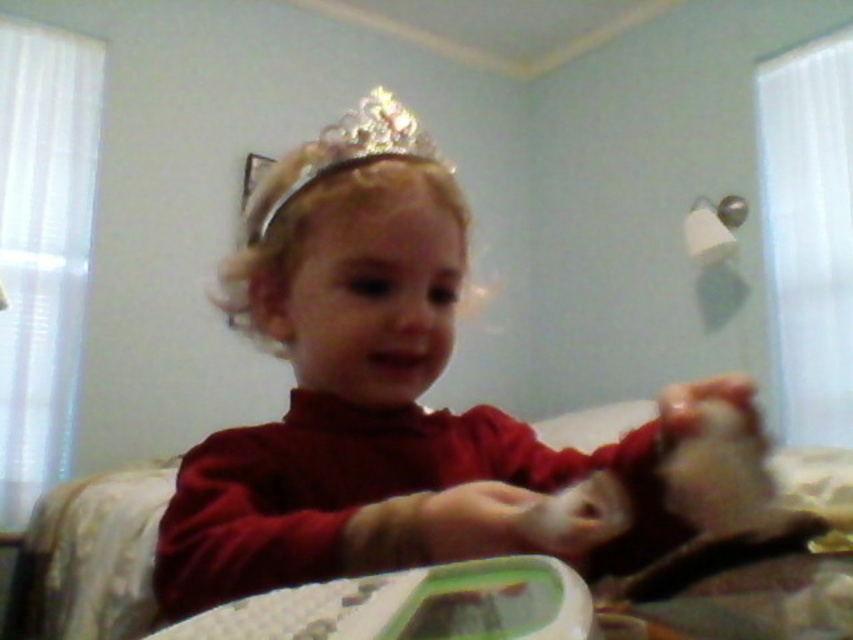
Question: Does matte red shirt at center have a lesser width compared to sparkly gold crown at upper center?

Choices:
 (A) yes
 (B) no

Answer: (A)

Question: Does matte red shirt at center appear under sparkly gold crown at upper center?

Choices:
 (A) no
 (B) yes

Answer: (B)

Question: Considering the relative positions of matte red shirt at center and sparkly gold crown at upper center in the image provided, where is matte red shirt at center located with respect to sparkly gold crown at upper center?

Choices:
 (A) left
 (B) right

Answer: (B)

Question: Which of the following is the closest to the observer?

Choices:
 (A) matte red shirt at center
 (B) sparkly gold crown at upper center

Answer: (A)